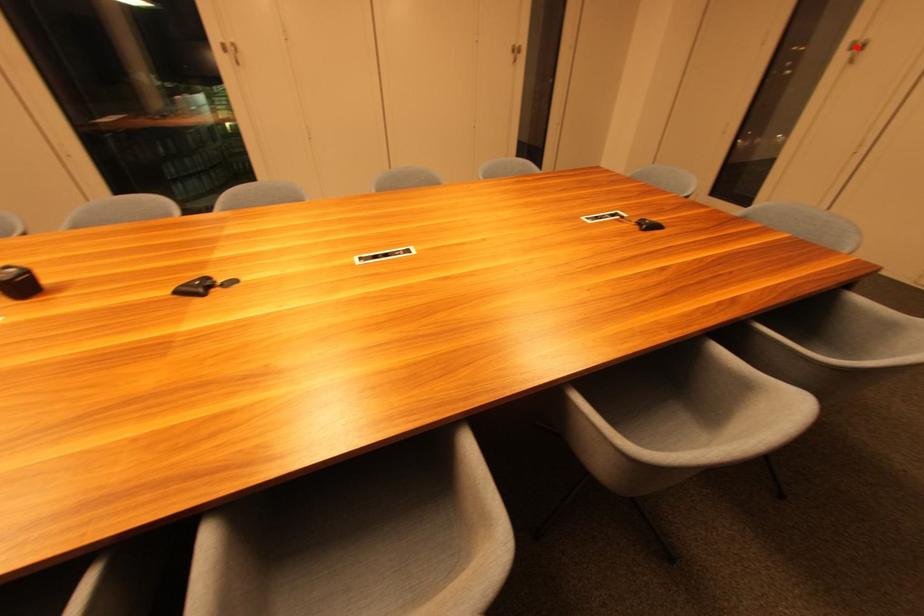
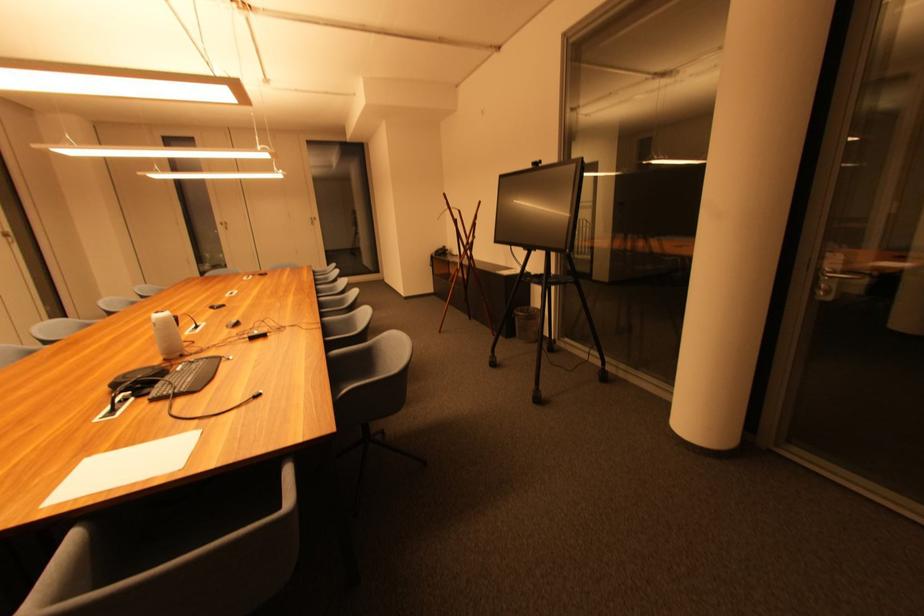
Question: I am providing you with two images of the same scene from different viewpoints. Given a red point in image1, look at the same physical point in image2. Is it:

Choices:
 (A) Closer to the viewpoint
 (B) Farther from the viewpoint

Answer: (A)